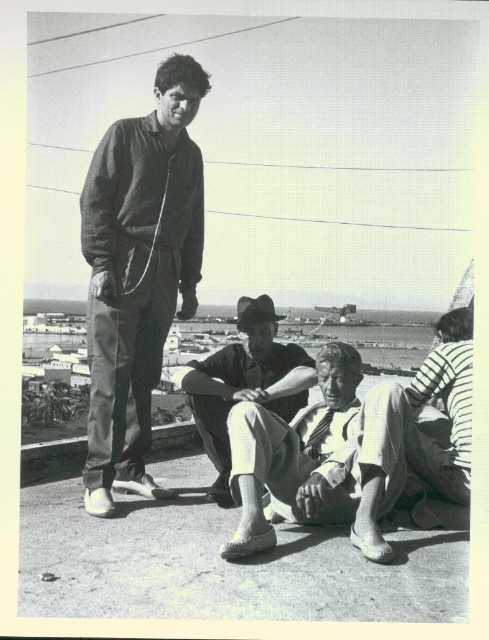
Is matte black jacket at upper left below matte black hat at center?

No.

Does matte black jacket at upper left have a lesser width compared to matte black hat at center?

Incorrect, matte black jacket at upper left's width is not less than matte black hat at center's.

Where is `matte black jacket at upper left`? Image resolution: width=489 pixels, height=640 pixels. matte black jacket at upper left is located at coordinates (138, 273).

Identify the location of matte black jacket at upper left. (138, 273).

Who is lower down, light beige cotton shirt at center or matte black hat at center?

light beige cotton shirt at center is lower down.

Which is behind, point (254, 540) or point (218, 497)?

Point (218, 497)

Find the location of a particular element. light beige cotton shirt at center is located at coordinates (295, 456).

Identify the location of light beige cotton shirt at center. The image size is (489, 640). (295, 456).

Can you confirm if light beige cotton shirt at center is wider than striped cotton shirt at lower right?

No, light beige cotton shirt at center is not wider than striped cotton shirt at lower right.

Between point (357, 380) and point (360, 497), which one is positioned behind?

The point (357, 380) is more distant.

Find the location of a particular element. This screenshot has width=489, height=640. light beige cotton shirt at center is located at coordinates (295, 456).